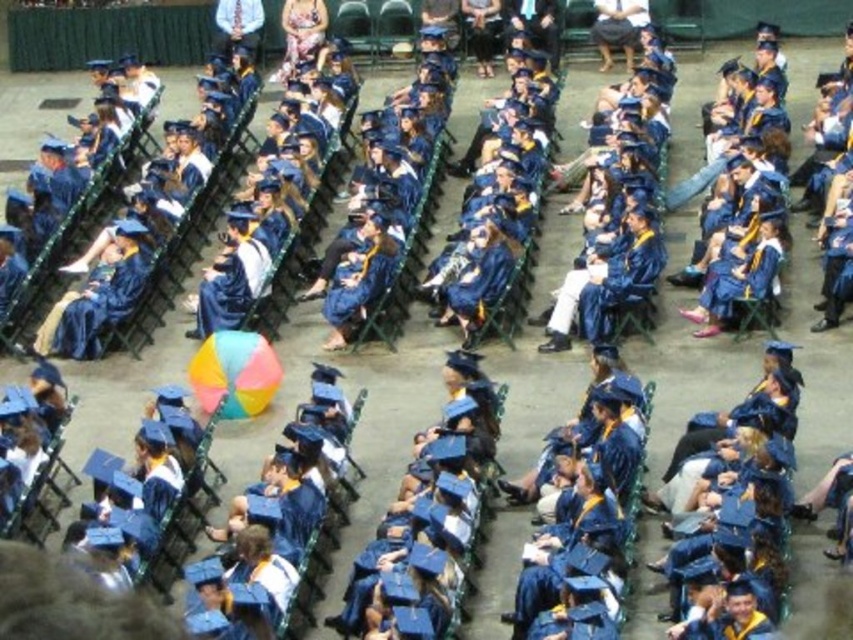
You are a photographer standing at the camera position. You want to capture a closeup shot of the matte blue gown at left. Given that your camera has a maximum zoom range of 20 meters, will you be able to focus on the gown from your current position?

The matte blue gown at left and camera are 29.88 meters apart from each other. Since the maximum zoom range of the camera is 20 meters, the distance is beyond the camera capability. Therefore, you cannot focus on the gown from your current position.

You are a photographer positioned at the back of the graduation ceremony. You want to capture a photo of both the matte blue gown at left and the matte blue gown at center in the same frame. Based on their positions, which gown should you adjust your camera to focus on first to ensure both are in the shot?

Since the matte blue gown at left is to the left of matte blue gown at center, you should focus on the matte blue gown at left first to ensure both are included in the frame.